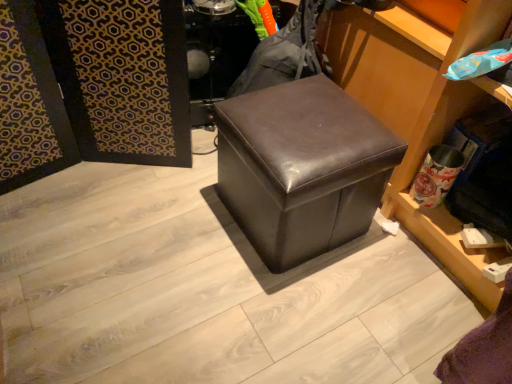
Question: Would you say matte brown ottoman at center is to the left or to the right of white matte towel at lower right in the picture?

Choices:
 (A) right
 (B) left

Answer: (B)

Question: In terms of size, does matte brown ottoman at center appear bigger or smaller than white matte towel at lower right?

Choices:
 (A) small
 (B) big

Answer: (B)

Question: Do you think matte brown ottoman at center is within white matte towel at lower right, or outside of it?

Choices:
 (A) outside
 (B) inside

Answer: (A)

Question: Is white matte towel at lower right to the left or to the right of matte brown ottoman at center in the image?

Choices:
 (A) left
 (B) right

Answer: (B)

Question: Is white matte towel at lower right situated inside matte brown ottoman at center or outside?

Choices:
 (A) outside
 (B) inside

Answer: (A)

Question: In terms of height, does white matte towel at lower right look taller or shorter compared to matte brown ottoman at center?

Choices:
 (A) short
 (B) tall

Answer: (B)

Question: Considering their positions, is white matte towel at lower right located in front of or behind matte brown ottoman at center?

Choices:
 (A) front
 (B) behind

Answer: (A)